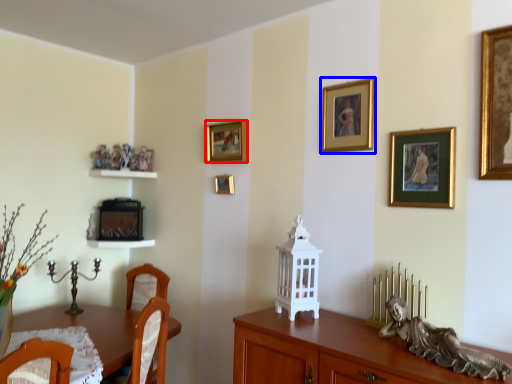
Question: Which point is closer to the camera, picture frame (highlighted by a red box) or picture frame (highlighted by a blue box)?

Choices:
 (A) picture frame
 (B) picture frame

Answer: (B)